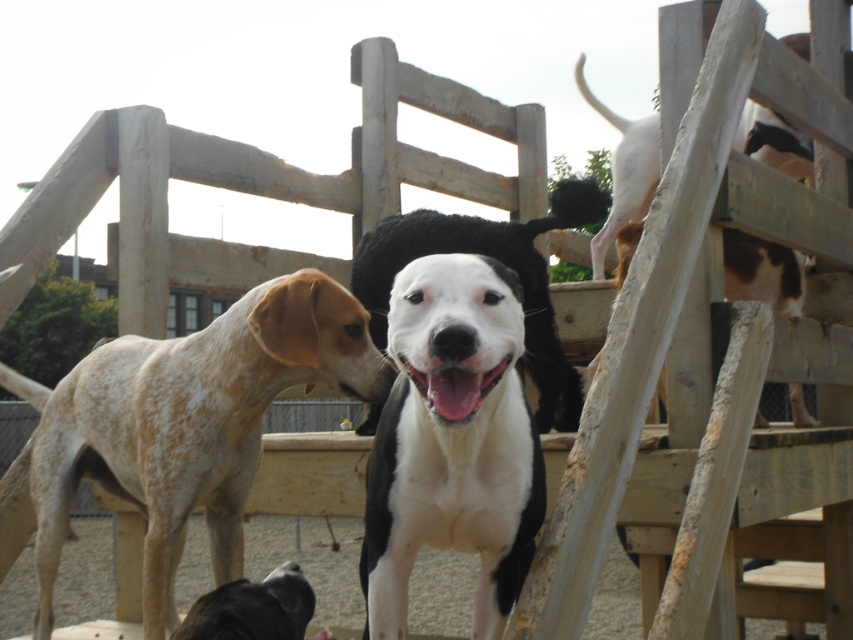
Question: Among these points, which one is farthest from the camera?

Choices:
 (A) (230, 596)
 (B) (567, 376)
 (C) (619, 221)
 (D) (241, 417)

Answer: (C)

Question: Does white smooth dog at center appear on the left side of white/black fur dog at center?

Choices:
 (A) yes
 (B) no

Answer: (A)

Question: Which point appears closest to the camera in this image?

Choices:
 (A) (735, 269)
 (B) (398, 452)
 (C) (241, 582)

Answer: (B)

Question: Estimate the real-world distances between objects in this image. Which object is closer to the black fur dog at lower center?

Choices:
 (A) white/black fur dog at center
 (B) speckled fur dog at left

Answer: (B)

Question: Is speckled fur dog at left positioned at the back of white/black fur dog at center?

Choices:
 (A) no
 (B) yes

Answer: (A)

Question: Can you confirm if speckled fur dog at left is thinner than white speckled fur at upper right?

Choices:
 (A) yes
 (B) no

Answer: (B)